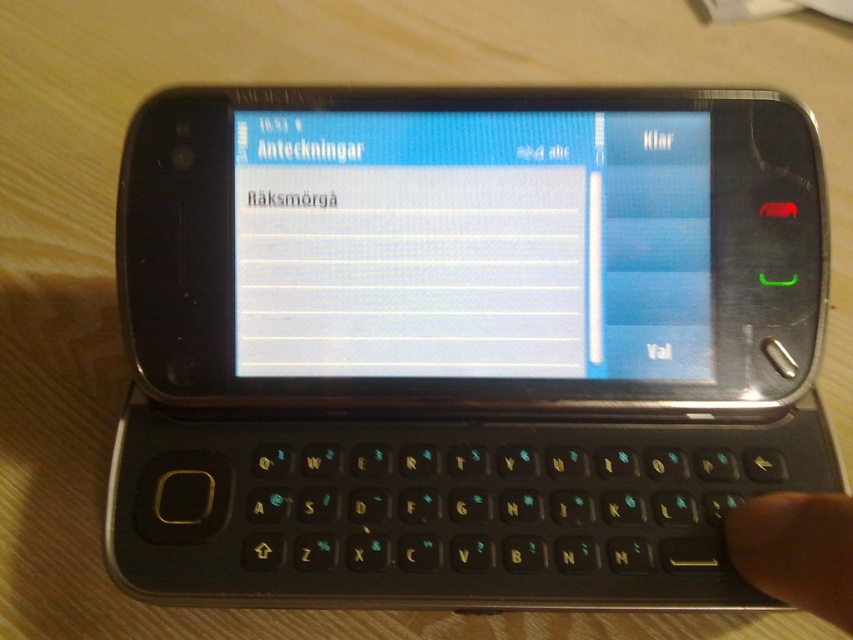
Question: Which point is farther to the camera?

Choices:
 (A) white glossy screen at center
 (B) skinsmoothhand at lower right

Answer: (A)

Question: Is white glossy screen at center to the right of skinsmoothhand at lower right from the viewer's perspective?

Choices:
 (A) no
 (B) yes

Answer: (A)

Question: Which object is closer to the camera taking this photo?

Choices:
 (A) skinsmoothhand at lower right
 (B) white glossy screen at center

Answer: (A)

Question: Does white glossy screen at center lie in front of skinsmoothhand at lower right?

Choices:
 (A) yes
 (B) no

Answer: (B)

Question: Can you confirm if white glossy screen at center is smaller than skinsmoothhand at lower right?

Choices:
 (A) yes
 (B) no

Answer: (B)